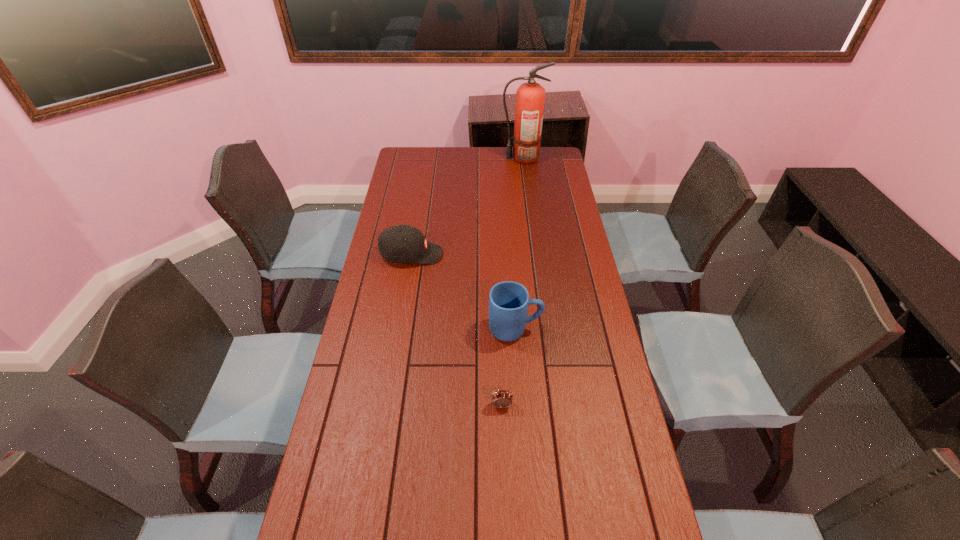
In order to click on vacant space located on the nozzle of the fire extinguisher in this screenshot , I will do 440,158.

At what (x,y) coordinates should I click in order to perform the action: click on free location located on the side of the mug with the handle. Please return your answer as a coordinate pair (x, y). The height and width of the screenshot is (540, 960). Looking at the image, I should click on (585, 329).

This screenshot has height=540, width=960. Identify the location of free location located with a logo on the front of the baseball cap. (458, 254).

This screenshot has width=960, height=540. Find the location of `vacant space located 0.220m on the face of the shortest object`. vacant space located 0.220m on the face of the shortest object is located at coordinates (505, 492).

This screenshot has height=540, width=960. In order to click on object at the far edge in this screenshot , I will do `click(530, 97)`.

The height and width of the screenshot is (540, 960). In order to click on object that is at the left edge in this screenshot , I will do `click(402, 243)`.

This screenshot has height=540, width=960. Find the location of `object present at the right edge`. object present at the right edge is located at coordinates (530, 97).

This screenshot has height=540, width=960. Identify the location of object located in the far right corner section of the desktop. (530, 97).

I want to click on vacant space at the left edge of the desktop, so click(343, 402).

In the image, there is a desktop. Where is `free space at the right edge`? free space at the right edge is located at coordinates (589, 350).